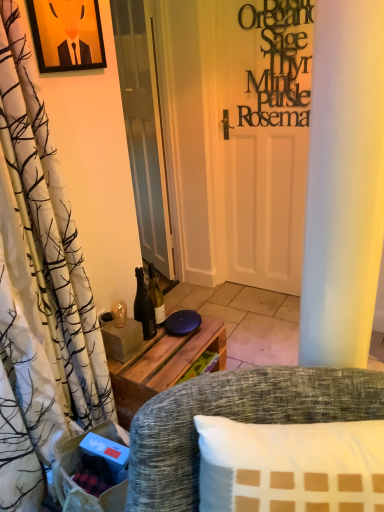
Find the location of a particular element. This screenshot has width=384, height=512. black matte sign at upper right is located at coordinates (279, 63).

Is textured gray fabric chair at lower center facing towards white glossy door at center?

No.

Between textured gray fabric chair at lower center and white glossy door at center, which one has more height?

Standing taller between the two is white glossy door at center.

Based on their positions, is textured gray fabric chair at lower center located to the left or right of white glossy door at center?

In the image, textured gray fabric chair at lower center appears on the right side of white glossy door at center.

From the picture: Is textured gray fabric chair at lower center outside of white glossy door at center?

Yes, textured gray fabric chair at lower center is outside of white glossy door at center.

Which is in front, point (287, 65) or point (256, 381)?

Positioned in front is point (256, 381).

Is black matte sign at upper right to the left or to the right of textured gray fabric chair at lower center in the image?

black matte sign at upper right is to the right of textured gray fabric chair at lower center.

Who is more distant, black matte sign at upper right or textured gray fabric chair at lower center?

Positioned behind is black matte sign at upper right.

The image size is (384, 512). What are the coordinates of `bottle below the matte black picture frame at upper left (from a real-world perspective)` in the screenshot? It's located at (144, 307).

From the image's perspective, which is below, matte black picture frame at upper left or shiny glass bottle at center?

shiny glass bottle at center appears lower in the image.

Measure the distance from matte black picture frame at upper left to shiny glass bottle at center.

35.53 inches.

Which is in front, matte black picture frame at upper left or shiny glass bottle at center?

matte black picture frame at upper left is more forward.

Which object is further away from the camera, black matte sign at upper right or white glossy door at center?

Positioned behind is white glossy door at center.

Is the surface of black matte sign at upper right in direct contact with white glossy door at center?

A: black matte sign at upper right and white glossy door at center are not in contact.

Considering the points (284, 119) and (163, 201), which point is behind, point (284, 119) or point (163, 201)?

Positioned behind is point (163, 201).

Does shiny glass bottle at center turn towards textured gray fabric chair at lower center?

No, shiny glass bottle at center is not turned towards textured gray fabric chair at lower center.

Can you confirm if shiny glass bottle at center is wider than textured gray fabric chair at lower center?

Incorrect, the width of shiny glass bottle at center does not surpass that of textured gray fabric chair at lower center.

From the image's perspective, is shiny glass bottle at center over textured gray fabric chair at lower center?

Yes.

Is shiny glass bottle at center to the right of matte black picture frame at upper left from the viewer's perspective?

Yes, shiny glass bottle at center is to the right of matte black picture frame at upper left.

How different are the orientations of shiny glass bottle at center and matte black picture frame at upper left in degrees?

1.75 degrees separate the facing orientations of shiny glass bottle at center and matte black picture frame at upper left.

Is shiny glass bottle at center with matte black picture frame at upper left?

No, shiny glass bottle at center is not beside matte black picture frame at upper left.

Is shiny glass bottle at center oriented towards matte black picture frame at upper left?

No, shiny glass bottle at center is not turned towards matte black picture frame at upper left.

Is shiny glass bottle at center facing towards white glossy door at center?

No.

You are a GUI agent. You are given a task and a screenshot of the screen. Output one action in this format:
    pyautogui.click(x=<x>, y=<y>)
    Task: Click on the door that appears above the shiny glass bottle at center (from a real-world perspective)
    The height and width of the screenshot is (512, 384).
    Given the screenshot: What is the action you would take?
    pyautogui.click(x=143, y=129)

Is shiny glass bottle at center inside or outside of white glossy door at center?

shiny glass bottle at center is not enclosed by white glossy door at center.

This screenshot has height=512, width=384. I want to click on chair to the right of white glossy door at center, so click(x=234, y=420).

Where is `chair in front of the black matte sign at upper right`? chair in front of the black matte sign at upper right is located at coordinates (234, 420).

Looking at the image, which one is located closer to black matte sign at upper right, white glossy door at center or textured gray fabric chair at lower center?

Based on the image, white glossy door at center appears to be nearer to black matte sign at upper right.

Estimate the real-world distances between objects in this image. Which object is closer to black matte sign at upper right, matte black picture frame at upper left or textured gray fabric chair at lower center?

Among the two, matte black picture frame at upper left is located nearer to black matte sign at upper right.

Which object lies further to the anchor point matte black picture frame at upper left, textured gray fabric chair at lower center or shiny glass bottle at center?

textured gray fabric chair at lower center.

Considering their positions, is textured gray fabric chair at lower center positioned closer to black matte sign at upper right than white glossy door at center?

white glossy door at center lies closer to black matte sign at upper right than the other object.

Estimate the real-world distances between objects in this image. Which object is closer to matte black picture frame at upper left, white glossy door at center or black matte sign at upper right?

black matte sign at upper right.

Which object lies further to the anchor point matte black picture frame at upper left, textured gray fabric chair at lower center or black matte sign at upper right?

textured gray fabric chair at lower center lies further to matte black picture frame at upper left than the other object.

Based on their spatial positions, is matte black picture frame at upper left or textured gray fabric chair at lower center closer to shiny glass bottle at center?

Among the two, textured gray fabric chair at lower center is located nearer to shiny glass bottle at center.

Looking at the image, which one is located further to matte black picture frame at upper left, white glossy door at center or shiny glass bottle at center?

Among the two, white glossy door at center is located further to matte black picture frame at upper left.

This screenshot has width=384, height=512. I want to click on picture frame between black matte sign at upper right and shiny glass bottle at center from top to bottom, so click(67, 34).

Identify the location of bottle between textured gray fabric chair at lower center and black matte sign at upper right along the z-axis. This screenshot has width=384, height=512. (144, 307).

Locate an element on the screen. This screenshot has height=512, width=384. picture frame between black matte sign at upper right and textured gray fabric chair at lower center vertically is located at coordinates (67, 34).

The height and width of the screenshot is (512, 384). I want to click on door that lies between matte black picture frame at upper left and shiny glass bottle at center from top to bottom, so click(143, 129).